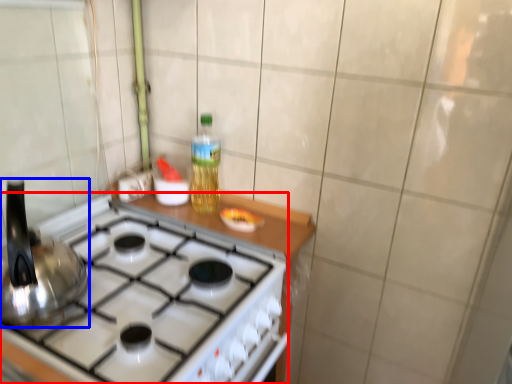
Question: Which object appears closest to the camera in this image, gas stove (highlighted by a red box) or kitchen appliance (highlighted by a blue box)?

Choices:
 (A) gas stove
 (B) kitchen appliance

Answer: (B)